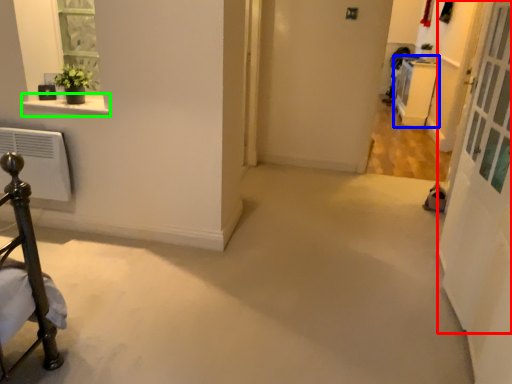
Question: Considering the real-world distances, which object is closest to screen door (highlighted by a red box)? furniture (highlighted by a blue box) or window sill (highlighted by a green box).

Choices:
 (A) furniture
 (B) window sill

Answer: (B)